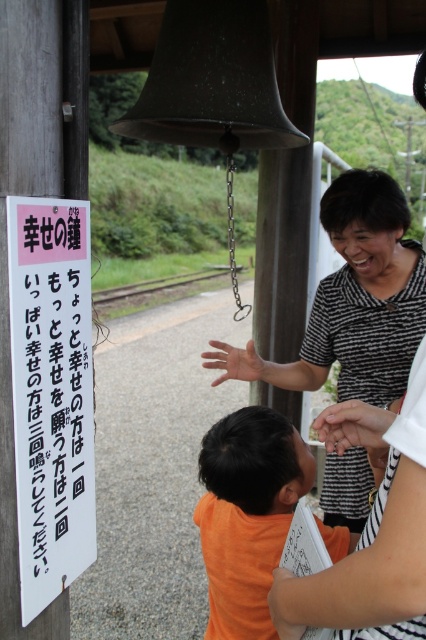
You are a photographer taking a picture of the striped fabric blouse at center and the orange fabric shirt at center. Which clothing item will appear larger in the photo?

The striped fabric blouse at center will appear larger in the photo because it is bigger than the orange fabric shirt at center.

A child is standing near a bell at a temple. The child has a pink paper sign at left and a smooth skin hand at center. The child wants to touch the sign with their hand. Can they reach it?

The pink paper sign at left is 24.90 inches away from the smooth skin hand at center. Since the distance is about 2 feet, the child can likely reach the sign with their hand.